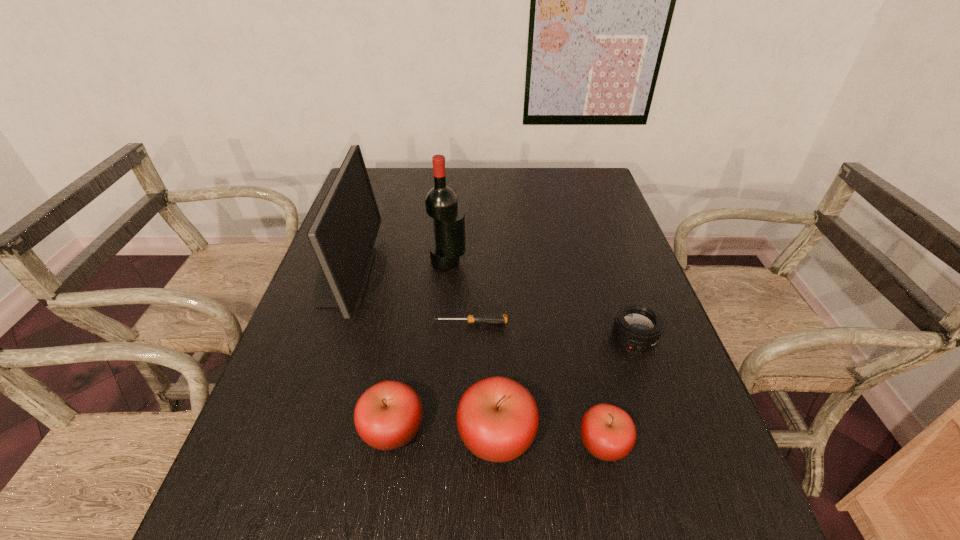
Find the location of `apple that stands as the closest to the shortest object`. apple that stands as the closest to the shortest object is located at coordinates (387, 416).

Where is `vacant area in the image that satisfies the following two spatial constraints: 1. on the screen side of the computer monitor; 2. on the left side of the screwdriver`? The width and height of the screenshot is (960, 540). vacant area in the image that satisfies the following two spatial constraints: 1. on the screen side of the computer monitor; 2. on the left side of the screwdriver is located at coordinates (327, 323).

You are a GUI agent. You are given a task and a screenshot of the screen. Output one action in this format:
    pyautogui.click(x=<x>, y=<y>)
    Task: Click on the vacant position in the image that satisfies the following two spatial constraints: 1. on the screen side of the leftmost object; 2. on the right side of the third tallest object
    This screenshot has height=540, width=960.
    Given the screenshot: What is the action you would take?
    pyautogui.click(x=287, y=437)

You are a GUI agent. You are given a task and a screenshot of the screen. Output one action in this format:
    pyautogui.click(x=<x>, y=<y>)
    Task: Click on the vacant region that satisfies the following two spatial constraints: 1. on the screen side of the computer monitor; 2. on the right side of the shortest object
    The image size is (960, 540).
    Given the screenshot: What is the action you would take?
    pyautogui.click(x=327, y=323)

Identify the location of free space in the image that satisfies the following two spatial constraints: 1. on the front side of the second object from right to left; 2. on the right side of the wine bottle. This screenshot has height=540, width=960. (433, 444).

Where is `vacant space that satisfies the following two spatial constraints: 1. on the front side of the leftmost apple; 2. on the left side of the fifth tallest object`? This screenshot has height=540, width=960. vacant space that satisfies the following two spatial constraints: 1. on the front side of the leftmost apple; 2. on the left side of the fifth tallest object is located at coordinates (391, 444).